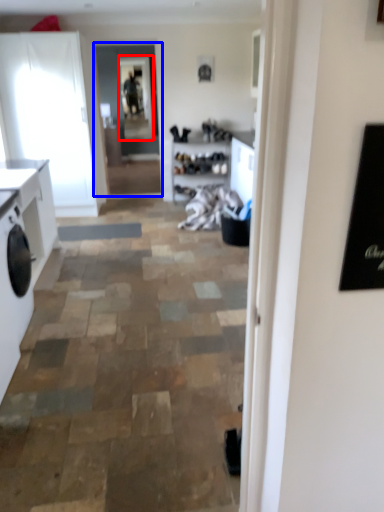
Question: Which object appears farthest to the camera in this image, window screen (highlighted by a red box) or glass door (highlighted by a blue box)?

Choices:
 (A) window screen
 (B) glass door

Answer: (A)